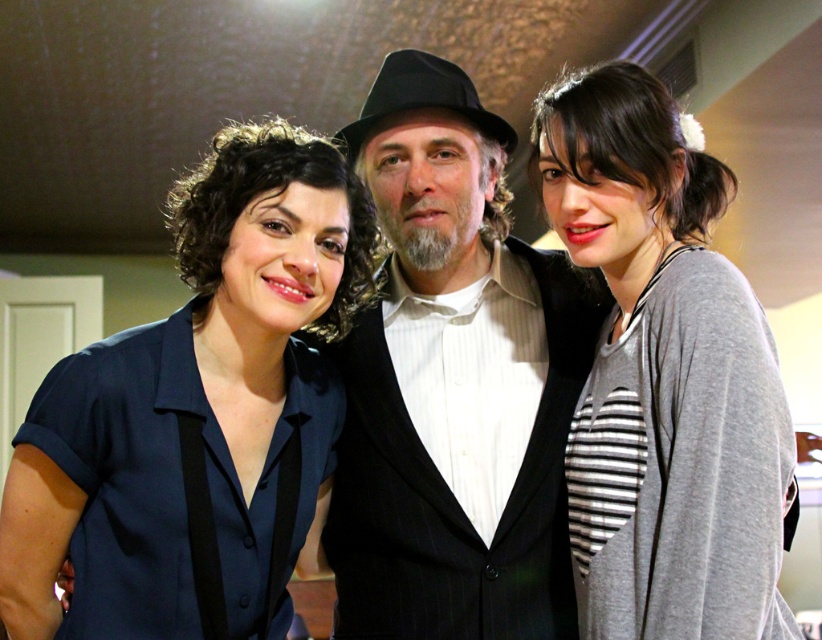
Based on the photo, does black pinstripe suit at center lie behind gray striped shirt at center?

Yes, black pinstripe suit at center is behind gray striped shirt at center.

Does black pinstripe suit at center appear on the left side of gray striped shirt at center?

Correct, you'll find black pinstripe suit at center to the left of gray striped shirt at center.

Locate an element on the screen. black pinstripe suit at center is located at coordinates (455, 384).

Which is below, black pinstripe suit at center or matte blue shirt at left?

matte blue shirt at left

Can you confirm if black pinstripe suit at center is smaller than matte blue shirt at left?

No, black pinstripe suit at center is not smaller than matte blue shirt at left.

Who is more forward, (548, 257) or (264, 396)?

Point (264, 396) is more forward.

At what (x,y) coordinates should I click in order to perform the action: click on black pinstripe suit at center. Please return your answer as a coordinate pair (x, y). Looking at the image, I should click on tap(455, 384).

Which is below, matte blue shirt at left or gray striped shirt at center?

Positioned lower is matte blue shirt at left.

Who is taller, matte blue shirt at left or gray striped shirt at center?

Standing taller between the two is gray striped shirt at center.

This screenshot has height=640, width=822. What do you see at coordinates (194, 403) in the screenshot?
I see `matte blue shirt at left` at bounding box center [194, 403].

You are a GUI agent. You are given a task and a screenshot of the screen. Output one action in this format:
    pyautogui.click(x=<x>, y=<y>)
    Task: Click on the matte blue shirt at left
    Image resolution: width=822 pixels, height=640 pixels.
    Given the screenshot: What is the action you would take?
    pyautogui.click(x=194, y=403)